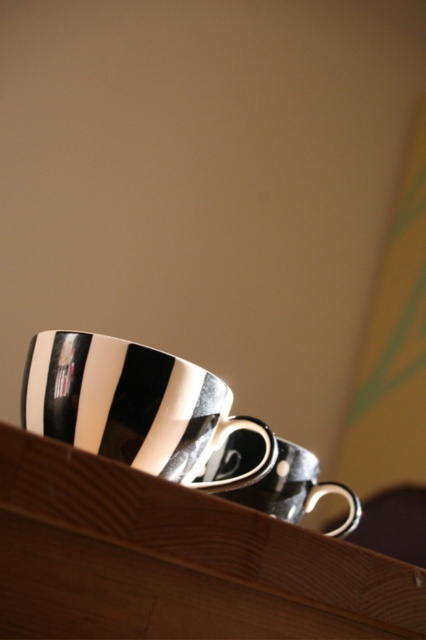
Is black glossy mug at upper center bigger than black glossy saucer at center?

Indeed, black glossy mug at upper center has a larger size compared to black glossy saucer at center.

Where is `black glossy mug at upper center`? The height and width of the screenshot is (640, 426). black glossy mug at upper center is located at coordinates (132, 406).

Locate an element on the screen. Image resolution: width=426 pixels, height=640 pixels. black glossy mug at upper center is located at coordinates (132, 406).

Which is below, black glossy mug at center or black glossy saucer at center?

black glossy mug at center

How much distance is there between black glossy mug at center and black glossy saucer at center?

black glossy mug at center is 2.19 inches away from black glossy saucer at center.

I want to click on black glossy mug at center, so click(296, 490).

Does point (245, 625) come closer to viewer compared to point (193, 481)?

That is True.

Between point (141, 518) and point (143, 396), which one is positioned in front?

Point (141, 518) is in front.

This screenshot has width=426, height=640. What are the coordinates of `wooden shelf at upper center` in the screenshot? It's located at (175, 561).